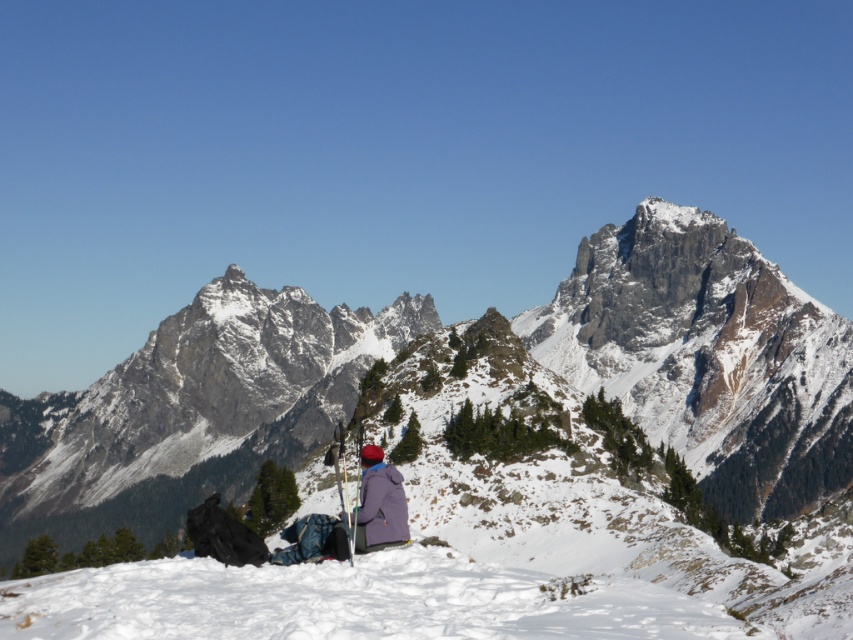
You are a GUI agent. You are given a task and a screenshot of the screen. Output one action in this format:
    pyautogui.click(x=<x>, y=<y>)
    Task: Click on the snowy rocky mountain at center
    The height and width of the screenshot is (640, 853).
    Given the screenshot: What is the action you would take?
    pyautogui.click(x=706, y=356)

How far apart are snowy rocky mountain at center and purple fleece jacket at center?

snowy rocky mountain at center and purple fleece jacket at center are 102.38 meters apart from each other.

Who is more distant from viewer, (387, 348) or (354, 516)?

The point (387, 348) is more distant.

At what (x,y) coordinates should I click in order to perform the action: click on snowy rocky mountain at center. Please return your answer as a coordinate pair (x, y). The image size is (853, 640). Looking at the image, I should click on (706, 356).